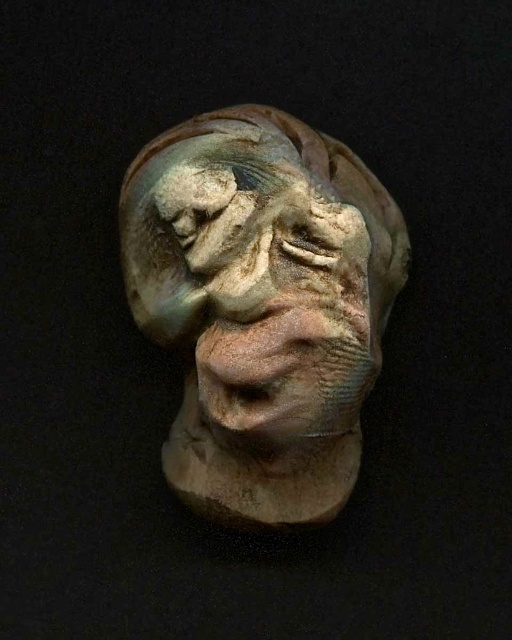
Question: Which object is farther from the camera taking this photo?

Choices:
 (A) matte clay sculpture at center
 (B) earthy clay sculpture at center

Answer: (A)

Question: Is matte clay sculpture at center wider than earthy clay sculpture at center?

Choices:
 (A) no
 (B) yes

Answer: (B)

Question: Considering the relative positions of matte clay sculpture at center and earthy clay sculpture at center in the image provided, where is matte clay sculpture at center located with respect to earthy clay sculpture at center?

Choices:
 (A) right
 (B) left

Answer: (B)

Question: Considering the relative positions of matte clay sculpture at center and earthy clay sculpture at center in the image provided, where is matte clay sculpture at center located with respect to earthy clay sculpture at center?

Choices:
 (A) left
 (B) right

Answer: (A)

Question: Which object appears closest to the camera in this image?

Choices:
 (A) earthy clay sculpture at center
 (B) matte clay sculpture at center

Answer: (A)

Question: Among these objects, which one is farthest from the camera?

Choices:
 (A) earthy clay sculpture at center
 (B) matte clay sculpture at center

Answer: (B)